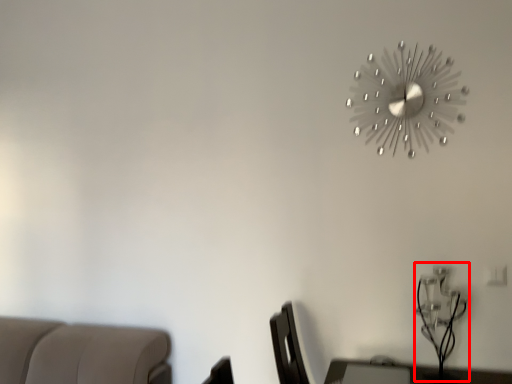
Question: Observing the image, what is the correct spatial positioning of table lamp (annotated by the red box) in reference to wall clock?

Choices:
 (A) right
 (B) left

Answer: (A)